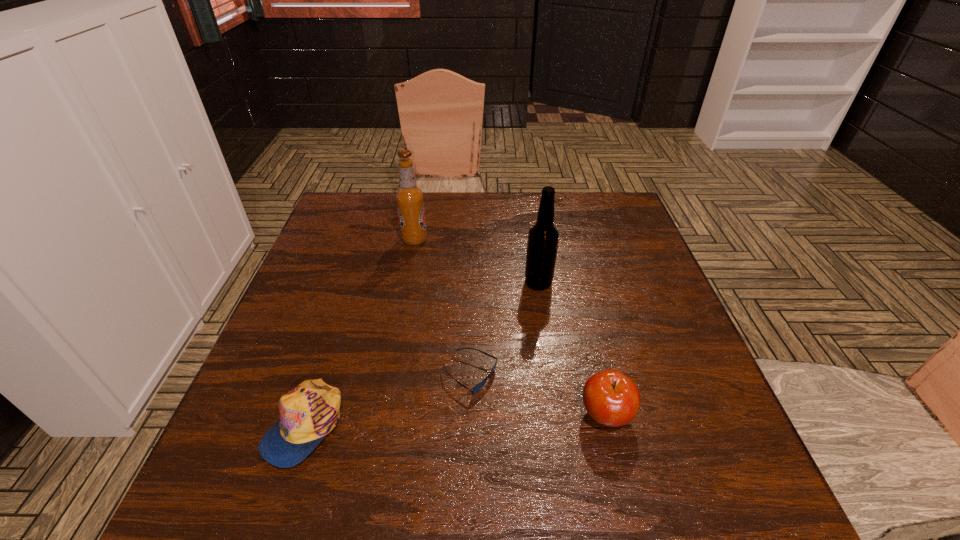
Locate an element on the screen. The height and width of the screenshot is (540, 960). the right beer bottle is located at coordinates (543, 237).

Where is `the nearer beer bottle`? The width and height of the screenshot is (960, 540). the nearer beer bottle is located at coordinates (543, 237).

Locate an element on the screen. The width and height of the screenshot is (960, 540). the farthest object is located at coordinates (409, 198).

In order to click on the fourth object from right to left in this screenshot , I will do `click(409, 198)`.

Find the location of `the third tallest object`. the third tallest object is located at coordinates (611, 398).

The width and height of the screenshot is (960, 540). Find the location of `the rightmost object`. the rightmost object is located at coordinates (611, 398).

Locate an element on the screen. the leftmost object is located at coordinates (310, 411).

Find the location of `cap`. cap is located at coordinates (310, 411).

At what (x,y) coordinates should I click in order to perform the action: click on the third object from left to right. Please return your answer as a coordinate pair (x, y). The image size is (960, 540). Looking at the image, I should click on (474, 390).

You are a GUI agent. You are given a task and a screenshot of the screen. Output one action in this format:
    pyautogui.click(x=<x>, y=<y>)
    Task: Click on the sunglasses
    The height and width of the screenshot is (540, 960).
    Given the screenshot: What is the action you would take?
    pyautogui.click(x=474, y=390)